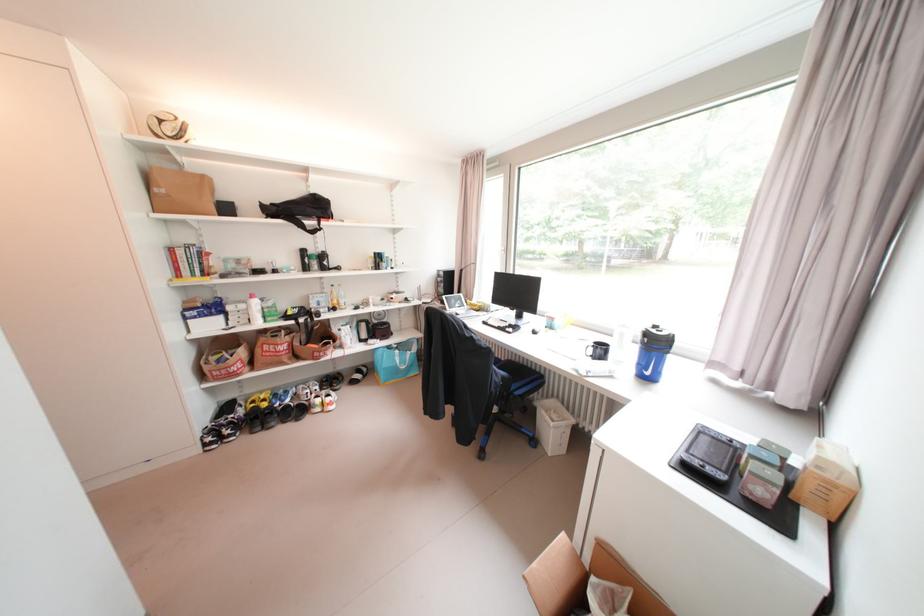
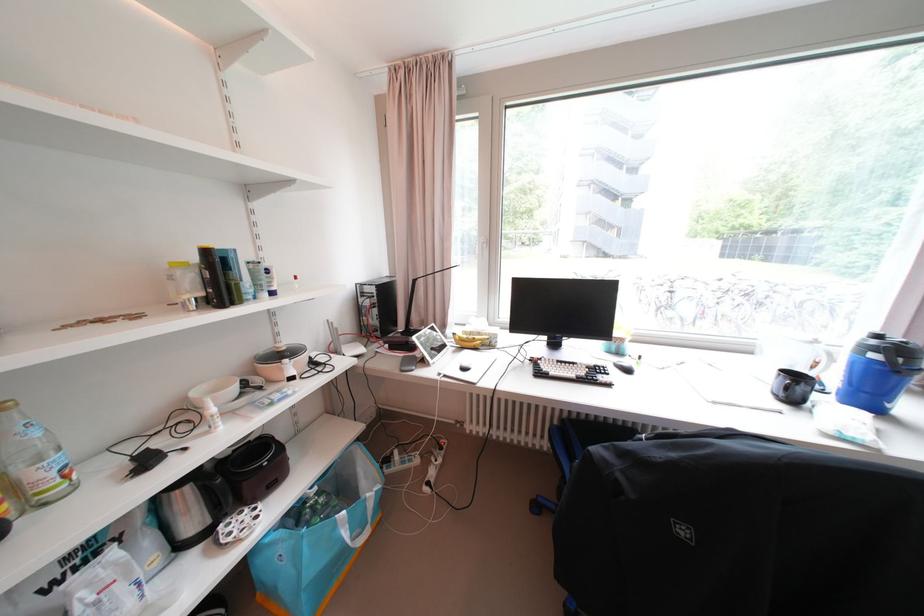
In the second image, find the point that corresponds to point 654,341 in the first image.

(909, 361)